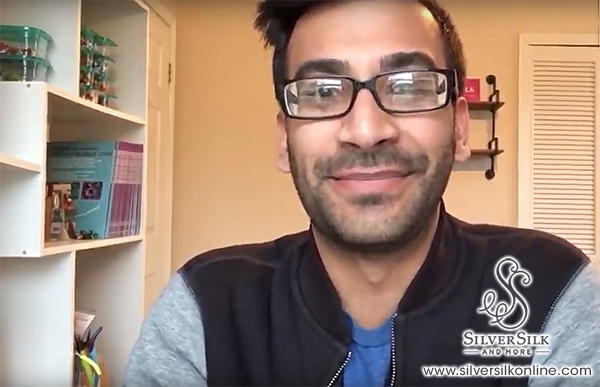
What are the coordinates of `white shelves` in the screenshot? It's located at (40, 312), (13, 230), (66, 76).